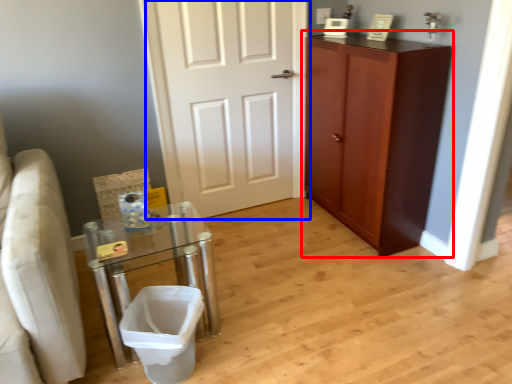
Question: Which point is further to the camera, cabinetry (highlighted by a red box) or door (highlighted by a blue box)?

Choices:
 (A) cabinetry
 (B) door

Answer: (B)